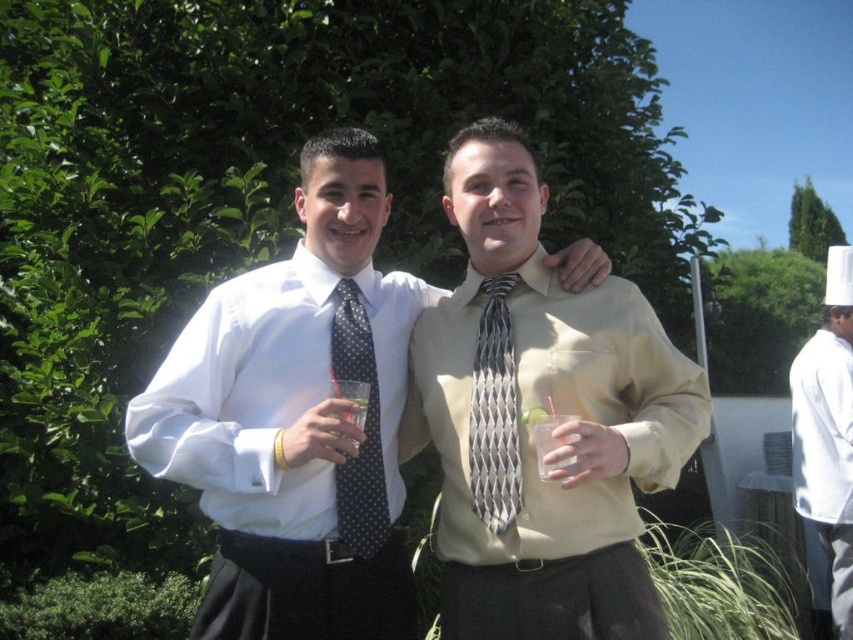
Consider the image. You are at a garden party and need to locate the matte beige shirt at center. According to the coordinates provided, where exactly would you look to find it?

The matte beige shirt at center is located at point coordinates (541,406).

You are at a garden party and see two items at the center of the image. One is a polka dot silk tie at center and the other is a clear glass at center. Which item is located to the left of the other?

The polka dot silk tie at center is positioned on the left side of clear glass at center.

You are at a garden party and see the white glossy shirt at center and the white chef hat at upper right. Which object is closer to you?

The white glossy shirt at center is closer to you because it is positioned over the white chef hat at upper right.